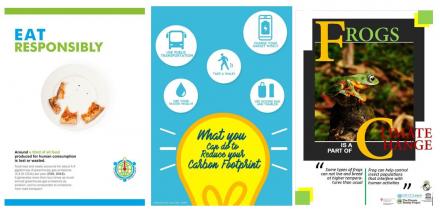
You are a GUI agent. You are given a task and a screenshot of the screen. Output one action in this format:
    pyautogui.click(x=<x>, y=<y>)
    Task: Click on the light bulb
    This screenshot has width=440, height=214.
    Given the screenshot: What is the action you would take?
    pyautogui.click(x=218, y=172)